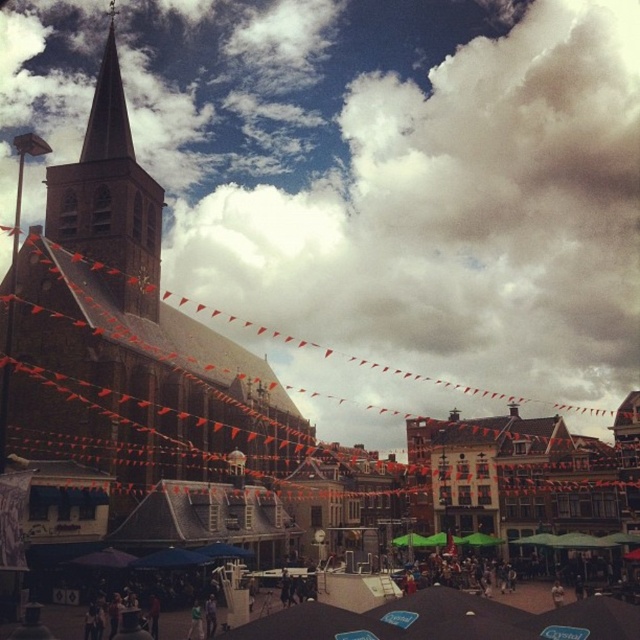
You are standing in the square and looking up at the cloudy sky at upper center and the brown stone church at center. Which one is positioned to the right side from your perspective?

The cloudy sky at upper center is positioned to the right of the brown stone church at center, so it is on the right side from your perspective.